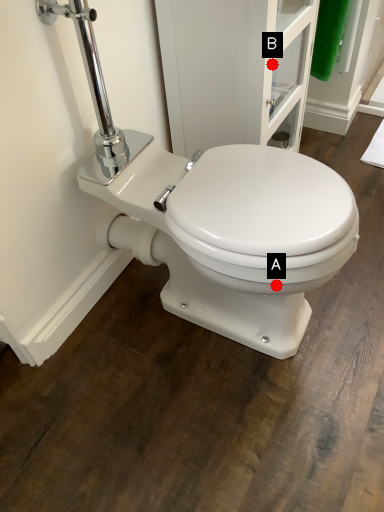
Question: Two points are circled on the image, labeled by A and B beside each circle. Which point appears closest to the camera in this image?

Choices:
 (A) A is closer
 (B) B is closer

Answer: (A)